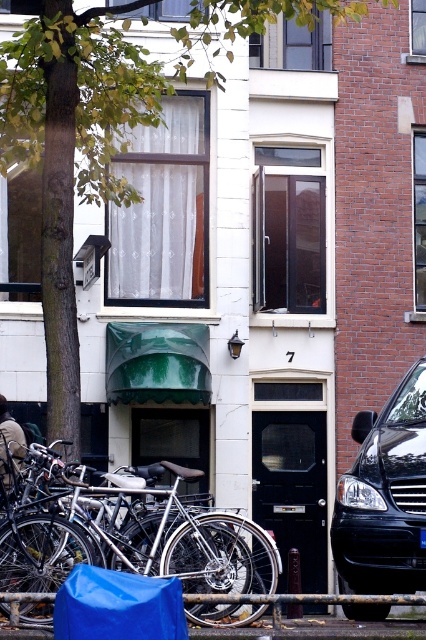
Looking at this image, you are standing at a point 10 meters away from the camera. You want to walk towards the point marked as point (92,493). Will you get closer to the camera or farther away?

The distance of point (92,493) from the camera is 10.34 meters. Since you are currently 10 meters away from the camera, walking towards point (92,493) would mean moving 0.34 meters closer to the camera.

In the scene shown: You are a delivery person trying to park your 2.5 meter long black glossy van at lower right. There is a silver metallic bicycle at center blocking the parking spot. Can the van still fit into the parking spot without moving the bicycle?

The silver metallic bicycle at center is in front of the black glossy van at lower right, meaning the bicycle is blocking the van. Since the van is 2.5 meters long, it cannot maneuver around the bicycle without moving it, so the van cannot fit into the parking spot without moving the bicycle.

Consider the image. You are a delivery person standing at the entrance of the white building. You need to park your black glossy van at lower right and place a blue tarp at lower left. Based on the scene, can you determine the correct spatial arrangement for parking the van and placing the tarp?

The black glossy van at lower right is above the blue tarp at lower left, so you should park the van in a position that is higher than where you place the tarp.